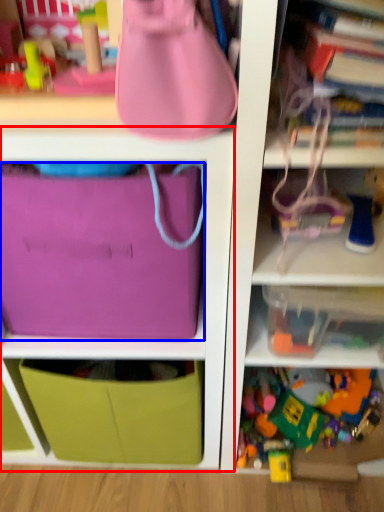
Question: Which point is closer to the camera, cabinet (highlighted by a red box) or pouch (highlighted by a blue box)?

Choices:
 (A) cabinet
 (B) pouch

Answer: (A)